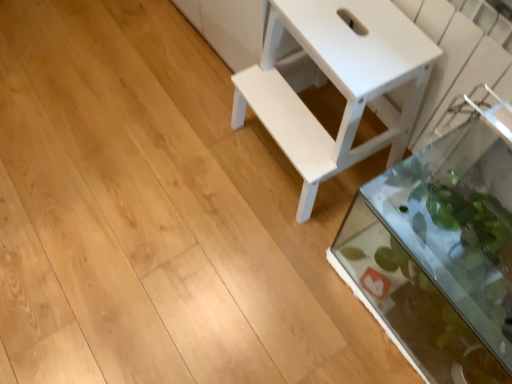
What are the coordinates of `vacant area that is in front of white matte table at center` in the screenshot? It's located at (285, 252).